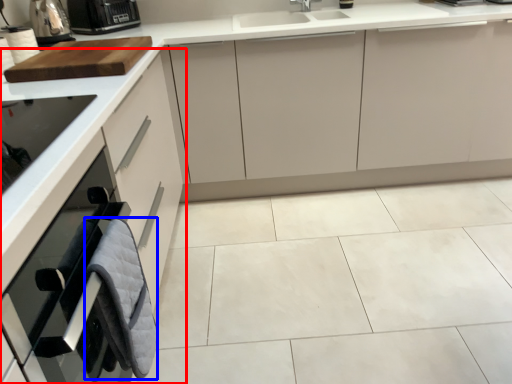
Question: Among these objects, which one is farthest to the camera, cabinetry (highlighted by a red box) or material (highlighted by a blue box)?

Choices:
 (A) cabinetry
 (B) material

Answer: (B)